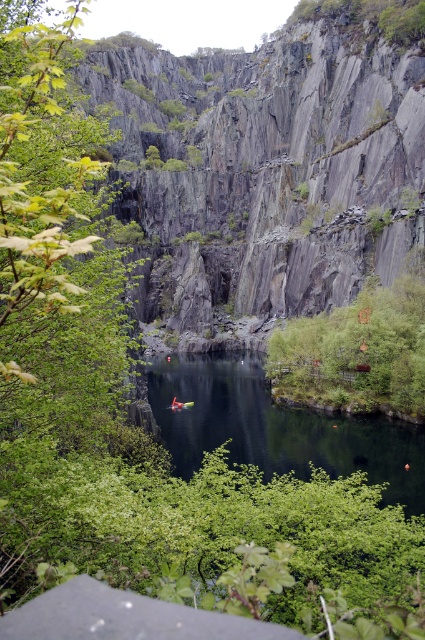
You are standing at the edge of the canyon looking at the greenish reflective water at center. Based on its position, can you estimate whether it is closer to the left or right side of the canyon?

The greenish reflective water at center is located at point coordinates approximately 0.669 on the x and 0.652 on the y axis. Since the x coordinate is closer to 1, it is positioned more towards the right side of the canyon.